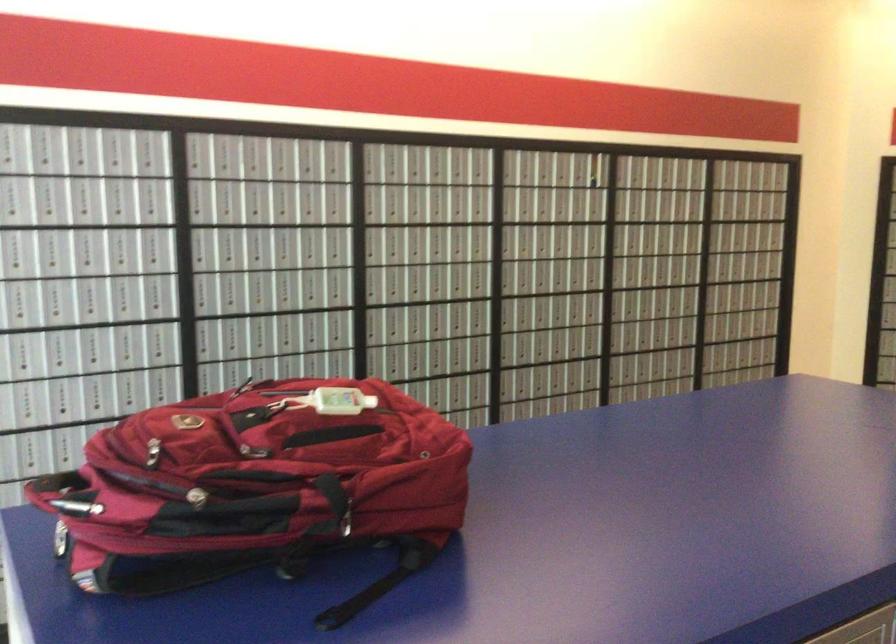
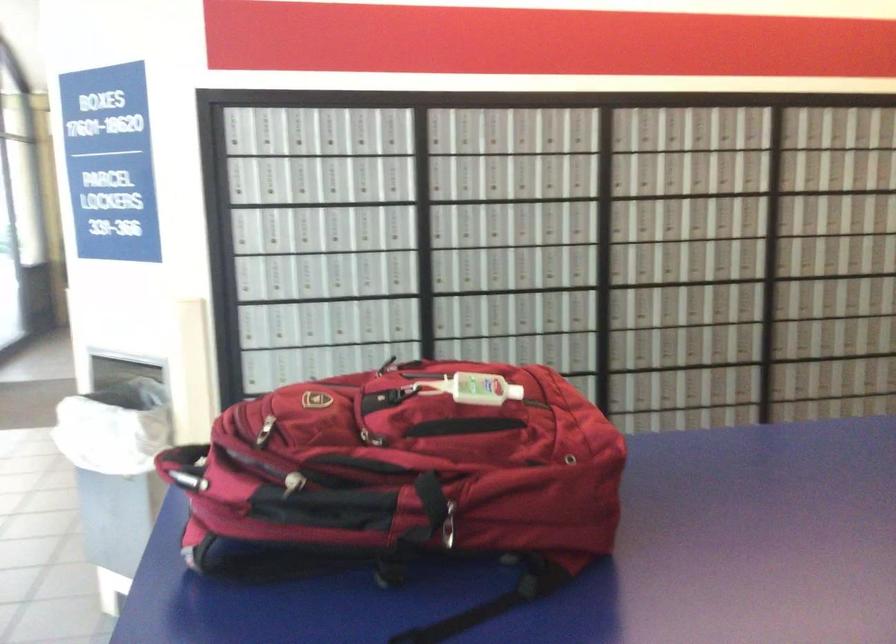
Question: The first image is from the beginning of the video and the second image is from the end. How did the camera likely rotate when shooting the video?

Choices:
 (A) Left
 (B) Right
 (C) Up
 (D) Down

Answer: (A)